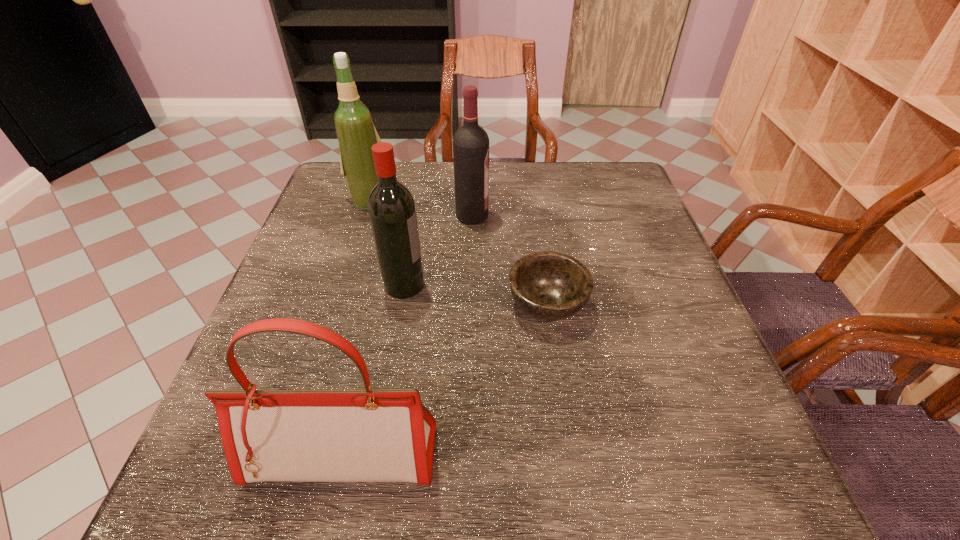
The width and height of the screenshot is (960, 540). In order to click on the leftmost wine bottle in this screenshot , I will do `click(356, 133)`.

This screenshot has height=540, width=960. Find the location of `the second object from right to left`. the second object from right to left is located at coordinates (471, 142).

Where is `the nearest wine bottle`? This screenshot has width=960, height=540. the nearest wine bottle is located at coordinates (392, 212).

You are a GUI agent. You are given a task and a screenshot of the screen. Output one action in this format:
    pyautogui.click(x=<x>, y=<y>)
    Task: Click on the nearest object
    The height and width of the screenshot is (540, 960).
    Given the screenshot: What is the action you would take?
    pyautogui.click(x=366, y=435)

You are a GUI agent. You are given a task and a screenshot of the screen. Output one action in this format:
    pyautogui.click(x=<x>, y=<y>)
    Task: Click on the rightmost object
    The height and width of the screenshot is (540, 960).
    Given the screenshot: What is the action you would take?
    coord(548,285)

Locate an element on the screen. The width and height of the screenshot is (960, 540). bowl is located at coordinates (548, 285).

At what (x,y) coordinates should I click in order to perform the action: click on free space located on the front-facing side of the leftmost wine bottle. Please return your answer as a coordinate pair (x, y). The width and height of the screenshot is (960, 540). Looking at the image, I should click on (352, 262).

Find the location of a particular element. This screenshot has height=540, width=960. vacant point located 0.060m on the label of the fourth object from left to right is located at coordinates (512, 215).

Locate an element on the screen. The width and height of the screenshot is (960, 540). vacant space located 0.250m on the label of the nearest wine bottle is located at coordinates (539, 285).

At what (x,y) coordinates should I click in order to perform the action: click on vacant space positioned on the right of the handbag. Please return your answer as a coordinate pair (x, y). This screenshot has width=960, height=540. Looking at the image, I should click on (588, 456).